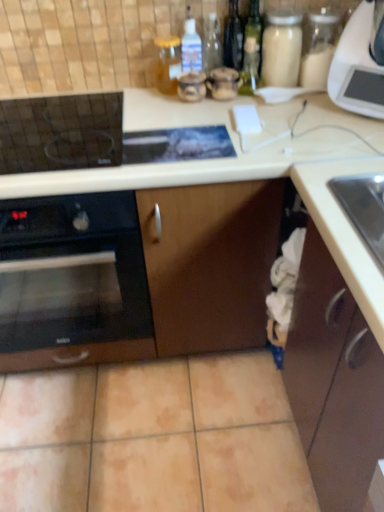
Question: Are white plastic microwave at upper right and brown matte cabinet at lower right far apart?

Choices:
 (A) yes
 (B) no

Answer: (B)

Question: From the image's perspective, is white plastic microwave at upper right beneath brown matte cabinet at lower right?

Choices:
 (A) yes
 (B) no

Answer: (B)

Question: Is white plastic microwave at upper right facing away from brown matte cabinet at lower right?

Choices:
 (A) no
 (B) yes

Answer: (A)

Question: Can you confirm if white plastic microwave at upper right is bigger than brown matte cabinet at lower right?

Choices:
 (A) yes
 (B) no

Answer: (B)

Question: Does white plastic microwave at upper right appear on the right side of brown matte cabinet at lower right?

Choices:
 (A) no
 (B) yes

Answer: (B)

Question: From a real-world perspective, is white plastic microwave at upper right positioned under brown matte cabinet at lower right based on gravity?

Choices:
 (A) yes
 (B) no

Answer: (B)

Question: Considering the relative sizes of brown matte cabinet at lower right and black glass oven at left in the image provided, is brown matte cabinet at lower right wider than black glass oven at left?

Choices:
 (A) no
 (B) yes

Answer: (A)

Question: Does brown matte cabinet at lower right have a greater height compared to black glass oven at left?

Choices:
 (A) no
 (B) yes

Answer: (B)

Question: Can you confirm if brown matte cabinet at lower right is shorter than black glass oven at left?

Choices:
 (A) no
 (B) yes

Answer: (A)

Question: Is brown matte cabinet at lower right oriented towards black glass oven at left?

Choices:
 (A) no
 (B) yes

Answer: (A)

Question: Does brown matte cabinet at lower right lie behind black glass oven at left?

Choices:
 (A) no
 (B) yes

Answer: (A)

Question: Is brown matte cabinet at lower right turned away from black glass oven at left?

Choices:
 (A) no
 (B) yes

Answer: (A)

Question: Can you confirm if black glass oven at left is positioned to the left of translucent glass jar at upper center?

Choices:
 (A) yes
 (B) no

Answer: (A)